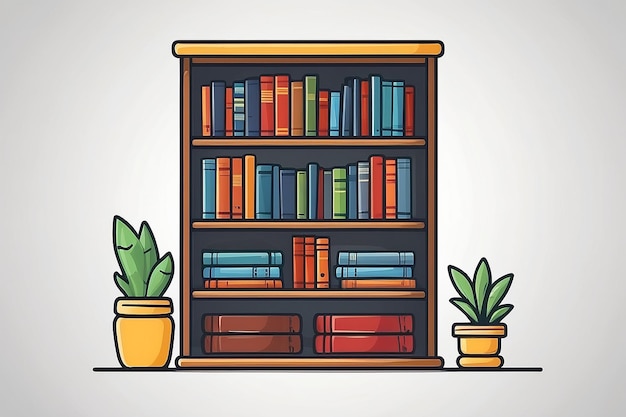
Where is `books laying down`? This screenshot has height=417, width=626. books laying down is located at coordinates (260, 316), (262, 345), (361, 346), (362, 321), (377, 251), (377, 268), (377, 284), (253, 256), (250, 268), (250, 284).